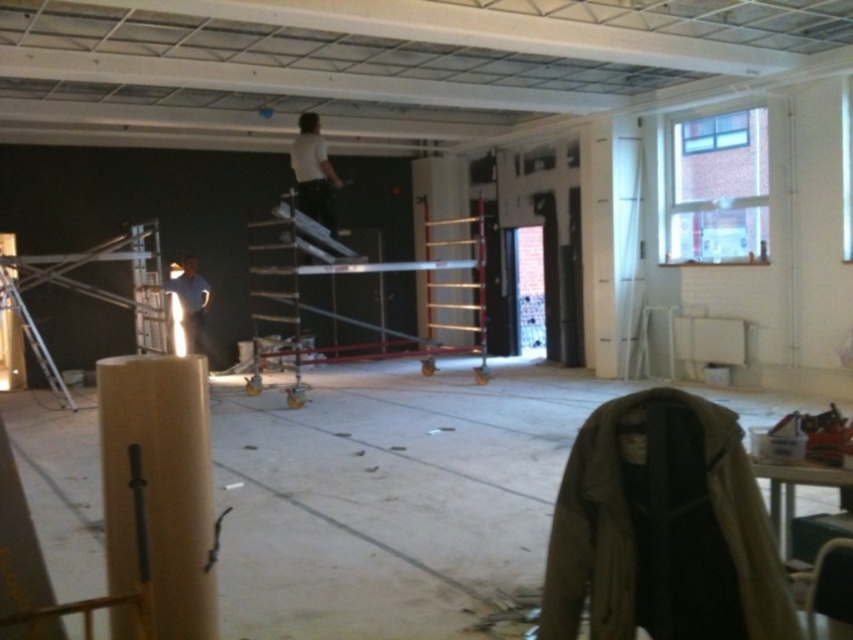
Question: Among these points, which one is nearest to the camera?

Choices:
 (A) (195, 356)
 (B) (302, 136)
 (C) (480, 374)
 (D) (194, 275)

Answer: (A)

Question: Among these points, which one is nearest to the camera?

Choices:
 (A) (120, 396)
 (B) (454, 236)

Answer: (A)

Question: Where is brown cardboard pillar at lower left located in relation to blue shirt at lower left in the image?

Choices:
 (A) left
 (B) right

Answer: (B)

Question: Does brown cardboard pillar at lower left have a larger size compared to white matte shirt at upper center?

Choices:
 (A) yes
 (B) no

Answer: (B)

Question: Is brown cardboard pillar at lower left smaller than wooden ladder at center?

Choices:
 (A) yes
 (B) no

Answer: (A)

Question: Among these objects, which one is farthest from the camera?

Choices:
 (A) wooden ladder at center
 (B) blue shirt at lower left
 (C) brown cardboard pillar at lower left
 (D) white matte shirt at upper center

Answer: (A)